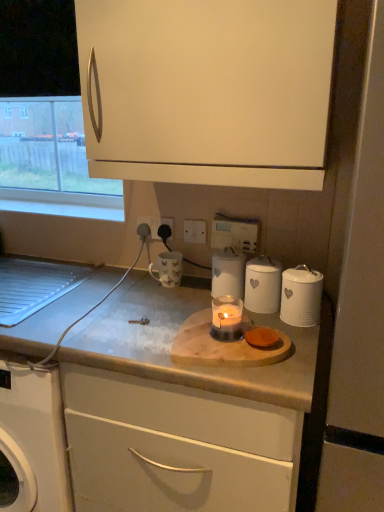
Where is `white glossy mug at center`? white glossy mug at center is located at coordinates (168, 269).

The height and width of the screenshot is (512, 384). What do you see at coordinates (301, 296) in the screenshot?
I see `white ceramic canister at right, which is the first kitchen appliance in right-to-left order` at bounding box center [301, 296].

Image resolution: width=384 pixels, height=512 pixels. What do you see at coordinates (157, 225) in the screenshot?
I see `black plastic socket at center, which appears as the second electric outlet when viewed from the right` at bounding box center [157, 225].

Where is `white plastic electric outlet at center, acting as the second electric outlet starting from the left`? The width and height of the screenshot is (384, 512). white plastic electric outlet at center, acting as the second electric outlet starting from the left is located at coordinates (195, 231).

In order to face white matte canister at center-right, the 2th kitchen appliance when ordered from right to left, should I rotate leftwards or rightwards?

To align with it, rotate right about 9.482°.

This screenshot has height=512, width=384. Find the location of `white glossy mug at center`. white glossy mug at center is located at coordinates (168, 269).

In the scene shown: Is white ceramic canister at center, marked as the first kitchen appliance in a left-to-right arrangement, shorter than clear glass window at upper left?

Yes, white ceramic canister at center, marked as the first kitchen appliance in a left-to-right arrangement, is shorter than clear glass window at upper left.

Is white ceramic canister at center, marked as the 3th kitchen appliance in a right-to-left arrangement, at the left side of clear glass window at upper left?

No.

Based on the photo, considering the sizes of objects white ceramic canister at center, marked as the first kitchen appliance in a left-to-right arrangement, and clear glass window at upper left in the image provided, who is thinner, white ceramic canister at center, marked as the first kitchen appliance in a left-to-right arrangement, or clear glass window at upper left?

Thinner between the two is clear glass window at upper left.

Consider the image. Is white ceramic canister at center, marked as the first kitchen appliance in a left-to-right arrangement, turned away from clear glass window at upper left?

No, white ceramic canister at center, marked as the first kitchen appliance in a left-to-right arrangement, is not facing away from clear glass window at upper left.

Which object is further away from the camera taking this photo, white matte canister at center-right, marked as the 2th kitchen appliance in a left-to-right arrangement, or white plastic electric outlet at center, acting as the second electric outlet starting from the left?

white plastic electric outlet at center, acting as the second electric outlet starting from the left, is more distant.

Would you say white matte canister at center-right, marked as the 2th kitchen appliance in a left-to-right arrangement, is outside white plastic electric outlet at center, positioned as the 1th electric outlet in right-to-left order?

That's correct, white matte canister at center-right, marked as the 2th kitchen appliance in a left-to-right arrangement, is outside of white plastic electric outlet at center, positioned as the 1th electric outlet in right-to-left order.

From the image's perspective, is white matte canister at center-right, marked as the 2th kitchen appliance in a left-to-right arrangement, under white plastic electric outlet at center, positioned as the 1th electric outlet in right-to-left order?

Indeed, from the image's perspective, white matte canister at center-right, marked as the 2th kitchen appliance in a left-to-right arrangement, is shown beneath white plastic electric outlet at center, positioned as the 1th electric outlet in right-to-left order.

I want to click on the 1st electric outlet behind the white matte canister at center-right, the 2th kitchen appliance when ordered from right to left, counting from the anchor's position, so click(195, 231).

Is white ceramic canister at center, marked as the 3th kitchen appliance in a right-to-left arrangement, beside white matte canister at center-right, marked as the 2th kitchen appliance in a left-to-right arrangement?

Yes, white ceramic canister at center, marked as the 3th kitchen appliance in a right-to-left arrangement, is right next to white matte canister at center-right, marked as the 2th kitchen appliance in a left-to-right arrangement, and making contact.

Can you tell me how much white ceramic canister at center, marked as the first kitchen appliance in a left-to-right arrangement, and white matte canister at center-right, marked as the 2th kitchen appliance in a left-to-right arrangement, differ in facing direction?

The facing directions of white ceramic canister at center, marked as the first kitchen appliance in a left-to-right arrangement, and white matte canister at center-right, marked as the 2th kitchen appliance in a left-to-right arrangement, are 0.00392 degrees apart.

Between white ceramic canister at center, marked as the first kitchen appliance in a left-to-right arrangement, and white matte canister at center-right, the 2th kitchen appliance when ordered from right to left, which one appears on the right side from the viewer's perspective?

From the viewer's perspective, white matte canister at center-right, the 2th kitchen appliance when ordered from right to left, appears more on the right side.

Is white ceramic canister at center, marked as the 3th kitchen appliance in a right-to-left arrangement, bigger or smaller than white matte canister at center-right, the 2th kitchen appliance when ordered from right to left?

Clearly, white ceramic canister at center, marked as the 3th kitchen appliance in a right-to-left arrangement, is larger in size than white matte canister at center-right, the 2th kitchen appliance when ordered from right to left.

Is white glossy mug at center next to white ceramic canister at center, marked as the 3th kitchen appliance in a right-to-left arrangement?

They are not placed beside each other.

Who is more distant, white glossy mug at center or white ceramic canister at center, marked as the 3th kitchen appliance in a right-to-left arrangement?

white glossy mug at center is behind.

From a real-world perspective, is white glossy mug at center physically below white ceramic canister at center, marked as the first kitchen appliance in a left-to-right arrangement?

Yes.

Is clear glass window at upper left a part of white plastic electric outlet at center, positioned as the 1th electric outlet in right-to-left order?

Definitely not — clear glass window at upper left is not inside white plastic electric outlet at center, positioned as the 1th electric outlet in right-to-left order.

Is there a large distance between white plastic electric outlet at center, acting as the second electric outlet starting from the left, and clear glass window at upper left?

No, white plastic electric outlet at center, acting as the second electric outlet starting from the left, is in close proximity to clear glass window at upper left.

From a real-world perspective, starting from the clear glass window at upper left, which electric outlet is the 2nd one below it? Please provide its 2D coordinates.

[(195, 231)]

Which is in front, point (200, 226) or point (86, 164)?

Positioned in front is point (86, 164).

What's the angular difference between white plastic electric outlet at center, positioned as the 1th electric outlet in right-to-left order, and white matte screen door at right's facing directions?

The angle between the facing direction of white plastic electric outlet at center, positioned as the 1th electric outlet in right-to-left order, and the facing direction of white matte screen door at right is 0.629 degrees.

Which of these two, white plastic electric outlet at center, acting as the second electric outlet starting from the left, or white matte screen door at right, stands shorter?

white plastic electric outlet at center, acting as the second electric outlet starting from the left.

Is white plastic electric outlet at center, positioned as the 1th electric outlet in right-to-left order, wider than white matte screen door at right?

Incorrect, the width of white plastic electric outlet at center, positioned as the 1th electric outlet in right-to-left order, does not surpass that of white matte screen door at right.

From the image's perspective, which is below, white plastic electric outlet at center, positioned as the 1th electric outlet in right-to-left order, or white matte screen door at right?

From the image's view, white matte screen door at right is below.

In the scene shown: Who is shorter, wooden cutting board at center or translucent glass candle at center?

wooden cutting board at center.

Identify the location of candle holder above the wooden cutting board at center (from the image's perspective). This screenshot has height=512, width=384. (x=227, y=318).

From the image's perspective, relative to translucent glass candle at center, is wooden cutting board at center above or below?

wooden cutting board at center is below translucent glass candle at center.

Measure the distance between wooden cutting board at center and translucent glass candle at center.

A distance of 2.40 inches exists between wooden cutting board at center and translucent glass candle at center.

The width and height of the screenshot is (384, 512). Find the location of `window above the white ceramic canister at center, marked as the first kitchen appliance in a left-to-right arrangement (from the image's perspective)`. window above the white ceramic canister at center, marked as the first kitchen appliance in a left-to-right arrangement (from the image's perspective) is located at coordinates (46, 117).

From a real-world perspective, starting from the white matte canister at center-right, the 2th kitchen appliance when ordered from right to left, which electric outlet is the 1st one vertically above it? Please provide its 2D coordinates.

[(195, 231)]

From the image, which object appears to be farther from white matte canister at center-right, marked as the 2th kitchen appliance in a left-to-right arrangement, white glossy mug at center or matte white cutting board at center, which appears as the 2th cabinetry when viewed from the top?

Based on the image, matte white cutting board at center, which appears as the 2th cabinetry when viewed from the top, appears to be further to white matte canister at center-right, marked as the 2th kitchen appliance in a left-to-right arrangement.

In the scene shown: Based on their spatial positions, is white ceramic canister at center, marked as the first kitchen appliance in a left-to-right arrangement, or wooden cutting board at center further from white matte cabinet at upper center, which is the second cabinetry from bottom to top?

wooden cutting board at center is further to white matte cabinet at upper center, which is the second cabinetry from bottom to top.

From the image, which object appears to be nearer to matte white cutting board at center, which appears as the 2th cabinetry when viewed from the top, white ceramic canister at right, which is the first kitchen appliance in right-to-left order, or wooden cutting board at center?

Among the two, wooden cutting board at center is located nearer to matte white cutting board at center, which appears as the 2th cabinetry when viewed from the top.

Which object lies nearer to the anchor point clear glass window at upper left, white glossy mug at center or white matte screen door at right?

The object closer to clear glass window at upper left is white glossy mug at center.

When comparing their distances from translucent glass candle at center, does white ceramic canister at right, the third kitchen appliance from the left, or clear glass window at upper left seem closer?

white ceramic canister at right, the third kitchen appliance from the left.

Which object lies nearer to the anchor point white glossy mug at center, matte white cutting board at center, arranged as the first cabinetry when ordered from the bottom, or white matte cabinet at upper center, which ranks as the 1th cabinetry in top-to-bottom order?

Among the two, matte white cutting board at center, arranged as the first cabinetry when ordered from the bottom, is located nearer to white glossy mug at center.

Looking at the image, which one is located closer to black plastic socket at center, which appears as the second electric outlet when viewed from the right, white ceramic canister at center, marked as the first kitchen appliance in a left-to-right arrangement, or white glossy mug at center?

Based on the image, white glossy mug at center appears to be nearer to black plastic socket at center, which appears as the second electric outlet when viewed from the right.

Which object lies further to the anchor point white plastic electric outlet at center, acting as the second electric outlet starting from the left, white matte screen door at right or clear glass window at upper left?

Among the two, white matte screen door at right is located further to white plastic electric outlet at center, acting as the second electric outlet starting from the left.

The image size is (384, 512). Identify the location of cutting board between white matte cabinet at upper center, which is the second cabinetry from bottom to top, and white matte screen door at right vertically. (223, 345).

You are a GUI agent. You are given a task and a screenshot of the screen. Output one action in this format:
    pyautogui.click(x=<x>, y=<y>)
    Task: Click on the candle holder between wooden cutting board at center and white plastic electric outlet at center, acting as the second electric outlet starting from the left, in the front-back direction
    The height and width of the screenshot is (512, 384).
    Given the screenshot: What is the action you would take?
    pyautogui.click(x=227, y=318)

Where is `candle holder between wooden cutting board at center and white ceramic canister at right, the third kitchen appliance from the left`? The width and height of the screenshot is (384, 512). candle holder between wooden cutting board at center and white ceramic canister at right, the third kitchen appliance from the left is located at coordinates (227, 318).

Identify the location of kitchen appliance located between white matte screen door at right and white matte canister at center-right, the 2th kitchen appliance when ordered from right to left, in the depth direction. This screenshot has height=512, width=384. (301, 296).